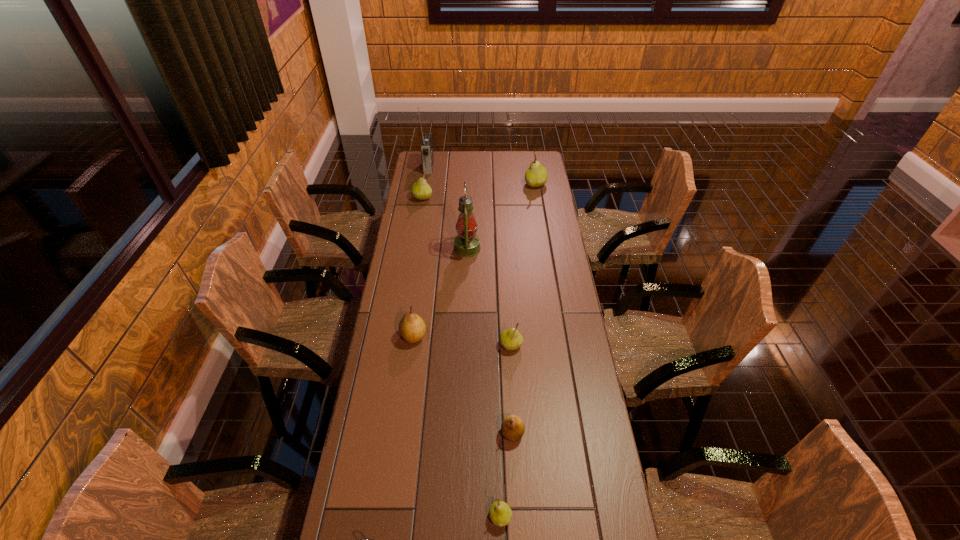
This screenshot has height=540, width=960. I want to click on vacant area situated 0.330m on the back of the nearer brown pear, so click(x=507, y=336).

The width and height of the screenshot is (960, 540). Find the location of `free space located on the right of the smallest green pear`. free space located on the right of the smallest green pear is located at coordinates (538, 517).

Locate an element on the screen. The image size is (960, 540). object that is at the far edge is located at coordinates (426, 146).

Locate an element on the screen. The image size is (960, 540). radio receiver that is at the left edge is located at coordinates (426, 146).

What are the coordinates of `object located at the right edge` in the screenshot? It's located at (536, 175).

This screenshot has width=960, height=540. What are the coordinates of `object positioned at the far left corner` in the screenshot? It's located at (426, 146).

This screenshot has width=960, height=540. In order to click on vacant space at the far edge in this screenshot , I will do `click(482, 172)`.

Find the location of a particular element. This screenshot has width=960, height=540. vacant area at the left edge is located at coordinates [412, 248].

Locate an element on the screen. This screenshot has height=540, width=960. blank space at the right edge of the desktop is located at coordinates (528, 215).

In the image, there is a desktop. Where is `free space at the far right corner`? free space at the far right corner is located at coordinates (526, 161).